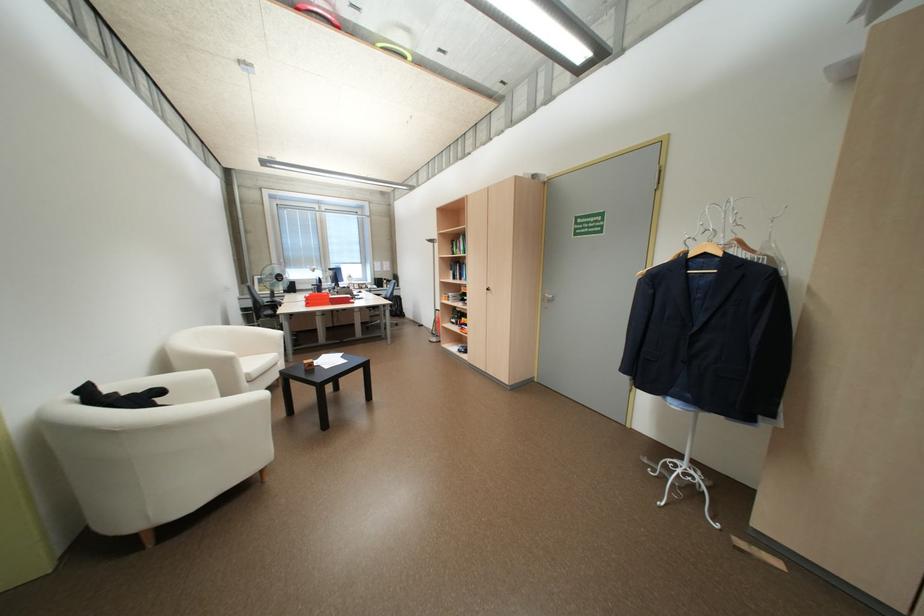
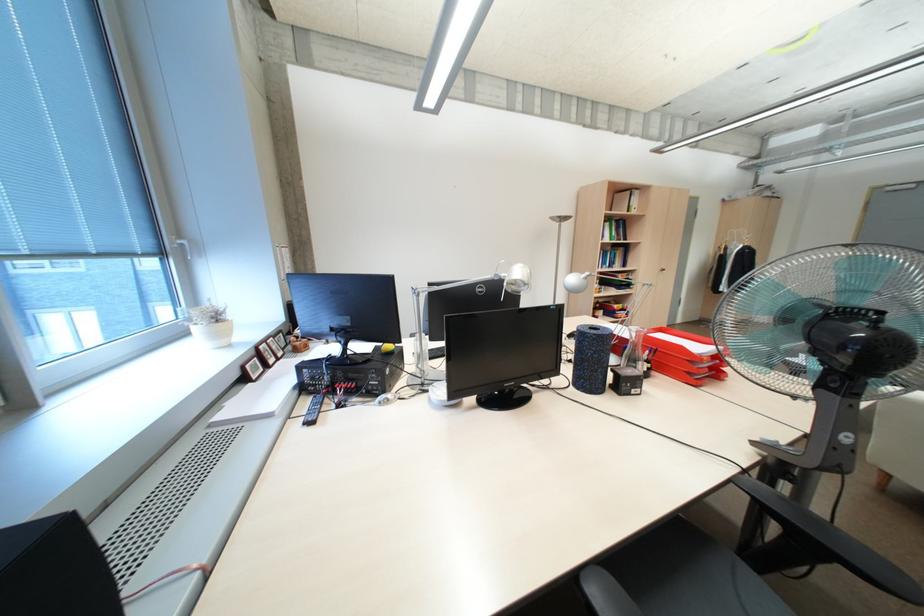
Find the pixel in the second image that matches point 469,249 in the first image.

(612, 236)